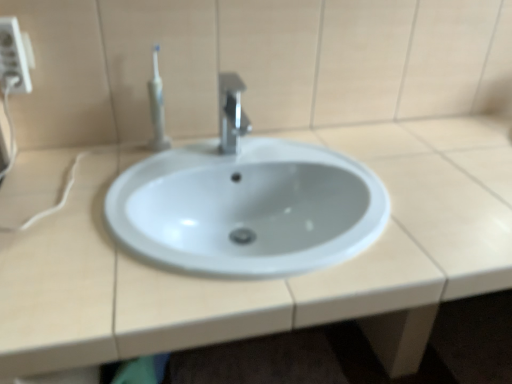
Locate an element on the screen. vacant space that's between polished metallic faucet at center and white plastic toothbrush at upper left is located at coordinates (x=195, y=157).